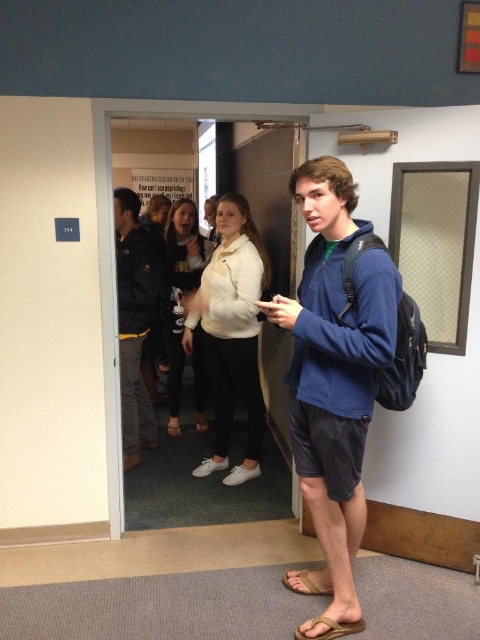
You are a security guard in the building and need to identify the location of two items in the hallway. The items are the dark blue jacket at center and the brown leather sandal at lower center. Which item is positioned higher up in the image?

The dark blue jacket at center is located above the brown leather sandal at lower center, so the dark blue jacket at center is positioned higher up in the image.